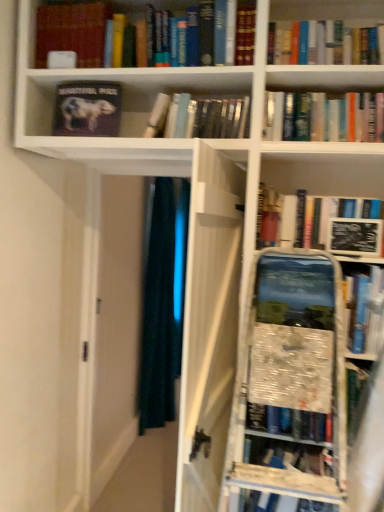
Question: In terms of size, does hardcover book at upper center, which is counted as the 1th book, starting from the right, appear bigger or smaller than matte black book at upper left, acting as the third book starting from the right?

Choices:
 (A) small
 (B) big

Answer: (B)

Question: Do you think hardcover book at upper center, the fourth book from the left, is within matte black book at upper left, acting as the third book starting from the right, or outside of it?

Choices:
 (A) outside
 (B) inside

Answer: (A)

Question: Estimate the real-world distances between objects in this image. Which object is closer to the dark blue fabric at center?

Choices:
 (A) matte black book at upper left, arranged as the 1th book when viewed from the left
 (B) matte black book at upper left, the 2th book positioned from the left
 (C) transparent glass door at center
 (D) hardcover book at upper center, the fourth book from the left
 (E) hardcover book at center, the 3th book from the left

Answer: (C)

Question: Which is nearer to the dark blue fabric at center?

Choices:
 (A) matte black book at upper left, arranged as the 4th book when viewed from the right
 (B) hardcover book at center, the 3th book from the left
 (C) transparent glass door at center
 (D) black matte book at upper right
 (E) matte black book at upper left, acting as the third book starting from the right

Answer: (C)